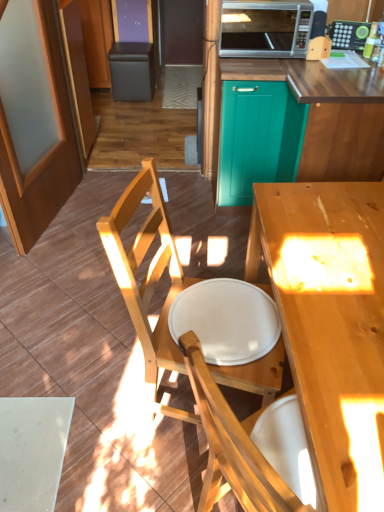
Question: Considering the positions of light wood chair at center and teal glossy cabinet at center, the second screen door viewed from the left, in the image, is light wood chair at center wider or thinner than teal glossy cabinet at center, the second screen door viewed from the left,?

Choices:
 (A) wide
 (B) thin

Answer: (B)

Question: Do you think light wood chair at center is within teal glossy cabinet at center, the second screen door viewed from the left, or outside of it?

Choices:
 (A) inside
 (B) outside

Answer: (B)

Question: Which of these objects is positioned closest to the green plastic microwave at upper center?

Choices:
 (A) wooden screen door at left, the first screen door positioned from the left
 (B) matte black bar stool at upper left
 (C) light wood desk at center
 (D) light wood chair at center
 (E) silver metallic microwave at upper center

Answer: (E)

Question: Which object is the farthest from the white matte plate at center?

Choices:
 (A) green plastic microwave at upper center
 (B) light wood chair at center
 (C) teal wood cabinet at upper center
 (D) teal glossy cabinet at center, which appears as the first screen door when viewed from the right
 (E) wooden screen door at left, the first screen door positioned from the left

Answer: (A)